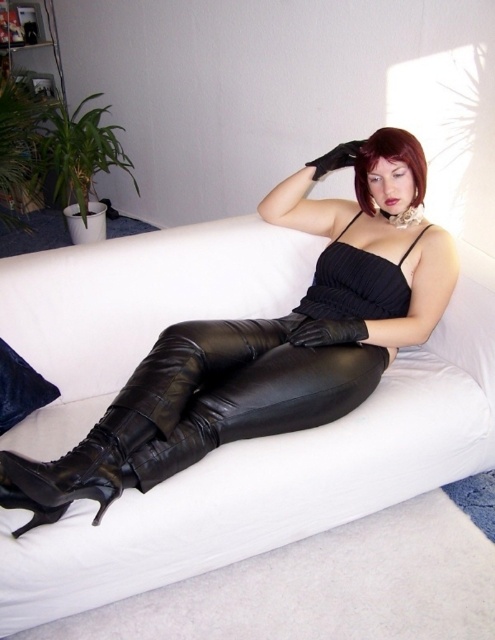
Looking at this image, you are a guest entering the living room and want to sit on the white leather couch at center. However, there is a black leather glove at center in your way. Can you sit on the couch without moving the glove?

The white leather couch at center is in front of the black leather glove at center, meaning the couch is closer to you than the glove. Therefore, you can sit on the couch without moving the glove since it is behind the couch.

You are a fashion designer who wants to showcase the black leather dress at center and the black leather glove at center in a photo shoot. Since the dress is in front of the glove, how should you adjust their positions to ensure both items are fully visible in the final image?

Since the black leather dress at center is in front of the black leather glove at center, you should move the glove slightly to the side or behind the dress to ensure both items are visible without one blocking the other.

You are standing in the living room and want to determine which of the two points, point (93, 593) or point (378, 365), is nearer to you. Based on the scene description, which point is closer?

Point (93, 593) is closer to the viewer than point (378, 365).